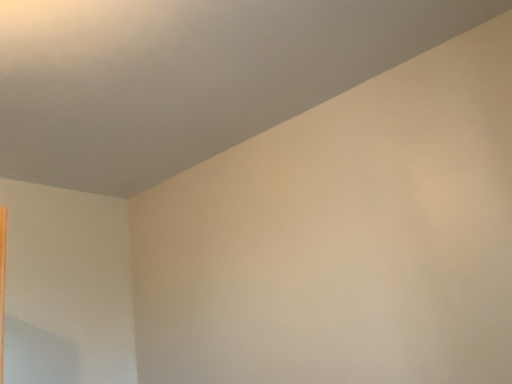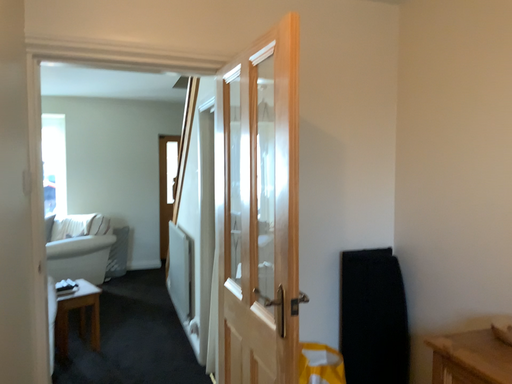
Question: Which way did the camera rotate in the video?

Choices:
 (A) rotated right
 (B) rotated left

Answer: (B)